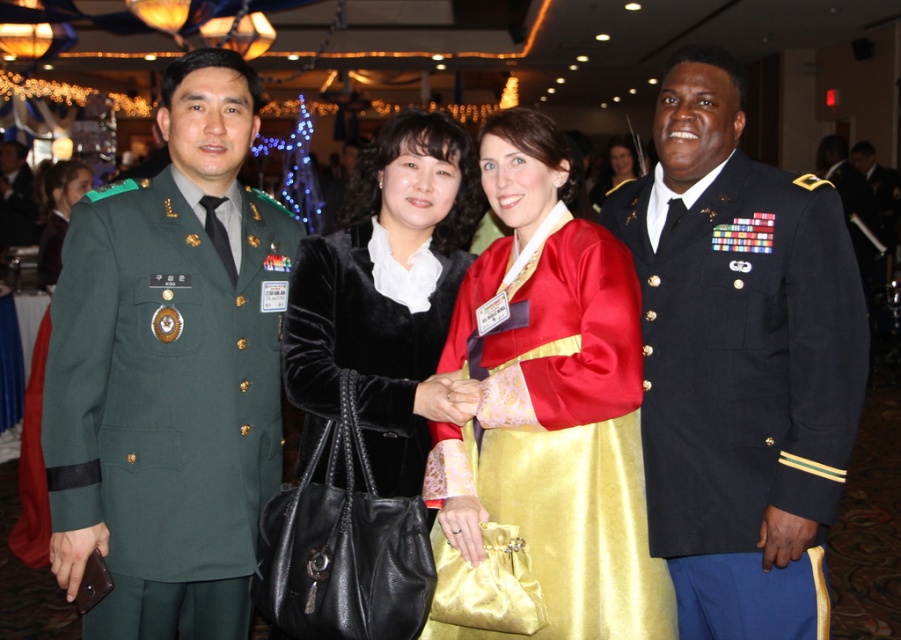
Based on the scene description, where is the green military uniform at left positioned in the image?

The green military uniform at left is positioned at point (x=170, y=371).

You are a photographer at the event. You need to adjust the lighting so that both the velvet black coat at center and the velvet black coat at upper left are equally visible. Since one is larger than the other, how should you position the lights to ensure even illumination?

The velvet black coat at center is larger in size than the velvet black coat at upper left. To ensure even illumination, position the light closer to the smaller coat at upper left and farther from the larger coat at center. This compensates for the size difference, making both appear equally visible.

You are a photographer at the event and need to adjust the lighting so that both the velvet black coat at center and the velvet black coat at upper left are equally visible. Which coat should you focus on first to ensure proper exposure?

The velvet black coat at center is in front of the velvet black coat at upper left, so you should focus on adjusting the lighting for the velvet black coat at center first to ensure it doesn not block the visibility of the one behind it.